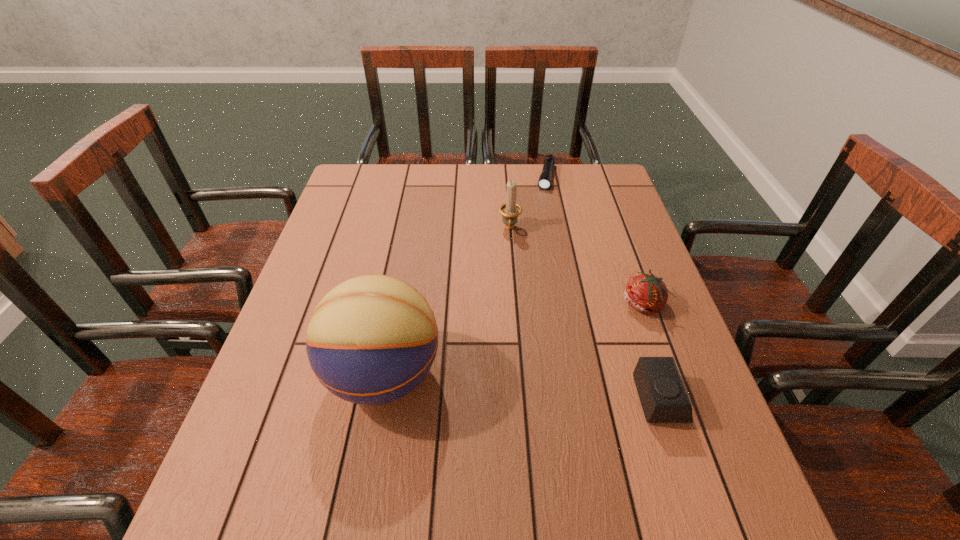
You are a GUI agent. You are given a task and a screenshot of the screen. Output one action in this format:
    pyautogui.click(x=<x>, y=<y>)
    Task: Click on the leftmost object
    This screenshot has width=960, height=540.
    Given the screenshot: What is the action you would take?
    coord(371,340)

I want to click on the tallest object, so click(371, 340).

Find the location of a particular element. This screenshot has width=960, height=540. alarm clock is located at coordinates (662, 394).

At what (x,y) coordinates should I click in order to perform the action: click on candle_holder. Please return your answer as a coordinate pair (x, y). The height and width of the screenshot is (540, 960). Looking at the image, I should click on coord(510,210).

The width and height of the screenshot is (960, 540). I want to click on the second object from left to right, so click(x=510, y=210).

The image size is (960, 540). I want to click on the third nearest object, so click(646, 293).

Locate an element on the screen. The height and width of the screenshot is (540, 960). the farthest object is located at coordinates (544, 183).

The height and width of the screenshot is (540, 960). Identify the location of the third object from left to right. (544, 183).

Where is `vacant region located 0.100m on the patterned surface of the tallest object`? This screenshot has width=960, height=540. vacant region located 0.100m on the patterned surface of the tallest object is located at coordinates point(278,375).

I want to click on vacant region located on the handle side of the fourth nearest object, so click(508, 268).